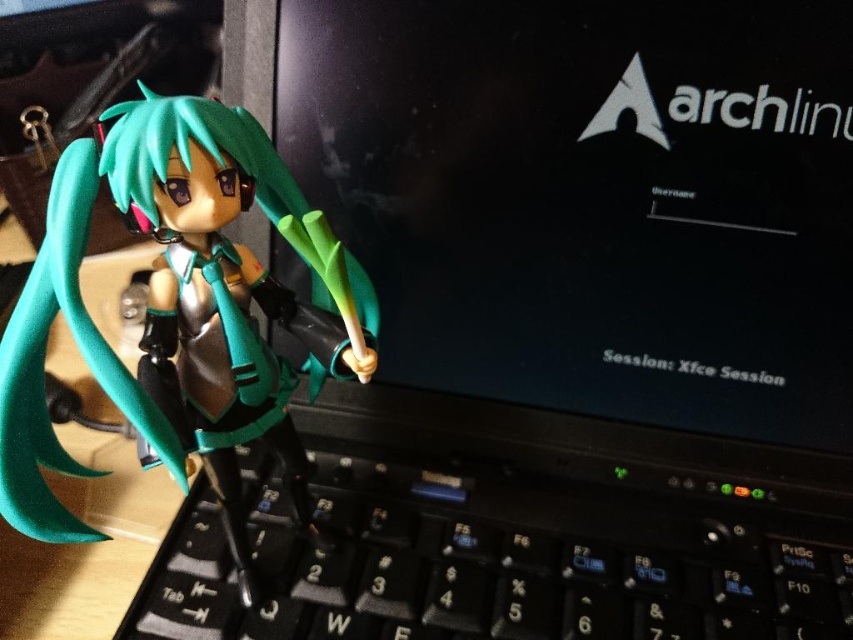
Question: Is black plastic keyboard at center closer to the viewer compared to semi-glossy green figure at left?

Choices:
 (A) no
 (B) yes

Answer: (A)

Question: Does black plastic keyboard at center appear on the left side of semi-glossy green figure at left?

Choices:
 (A) yes
 (B) no

Answer: (B)

Question: Which object is closer to the camera taking this photo?

Choices:
 (A) semi-glossy green figure at left
 (B) black plastic keyboard at center

Answer: (A)

Question: From the image, what is the correct spatial relationship of black plastic keyboard at center in relation to semi-glossy green figure at left?

Choices:
 (A) above
 (B) below

Answer: (B)